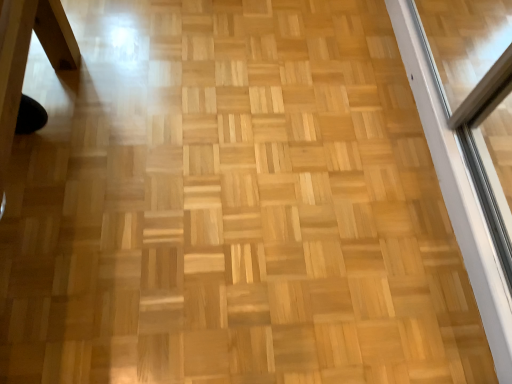
This screenshot has width=512, height=384. What do you see at coordinates (457, 194) in the screenshot? I see `transparent glass door at right` at bounding box center [457, 194].

Where is `transparent glass door at right`? The height and width of the screenshot is (384, 512). transparent glass door at right is located at coordinates (457, 194).

Locate an element on the screen. Image resolution: width=512 pixels, height=384 pixels. transparent glass door at right is located at coordinates (457, 194).